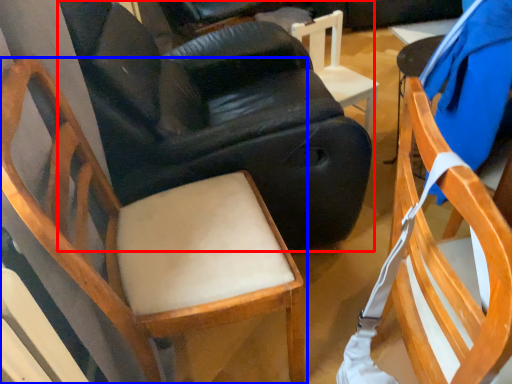
Question: Which object appears closest to the camera in this image, chair (highlighted by a red box) or chair (highlighted by a blue box)?

Choices:
 (A) chair
 (B) chair

Answer: (B)